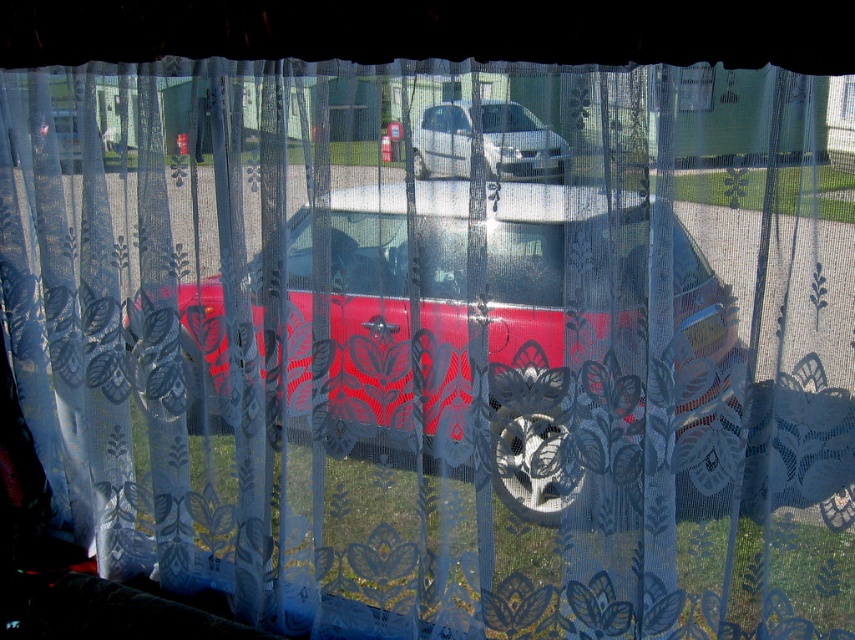
The width and height of the screenshot is (855, 640). What do you see at coordinates (373, 316) in the screenshot?
I see `shiny metallic car at center` at bounding box center [373, 316].

Between point (402, 316) and point (441, 173), which one is positioned behind?

The point (402, 316) is behind.

Image resolution: width=855 pixels, height=640 pixels. I want to click on shiny metallic car at center, so click(373, 316).